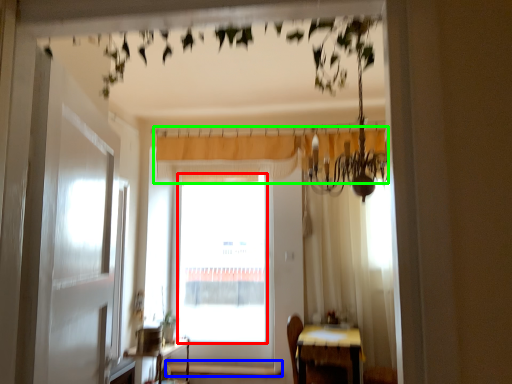
Question: Considering the real-world distances, which object is closest to window screen (highlighted by a red box)? window sill (highlighted by a blue box) or curtain (highlighted by a green box).

Choices:
 (A) window sill
 (B) curtain

Answer: (A)